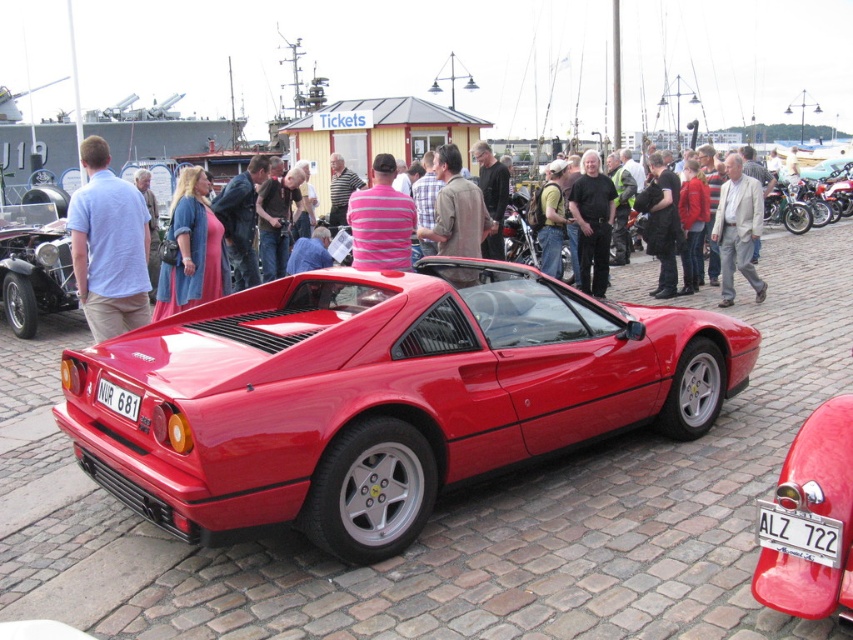
Question: Which point is closer to the camera taking this photo?

Choices:
 (A) (670, 192)
 (B) (115, 179)

Answer: (B)

Question: Which of the following is the farthest from the observer?

Choices:
 (A) (659, 172)
 (B) (198, 260)
 (C) (543, 253)

Answer: (A)

Question: Does denim jacket at center have a larger size compared to matte black shirt at center?

Choices:
 (A) no
 (B) yes

Answer: (A)

Question: Considering the relative positions of matte red ferrari at center and shiny chrome vintage car at left in the image provided, where is matte red ferrari at center located with respect to shiny chrome vintage car at left?

Choices:
 (A) below
 (B) above

Answer: (A)

Question: Which point is closer to the camera?

Choices:
 (A) (730, 264)
 (B) (12, 320)
 (C) (480, 212)

Answer: (C)

Question: Can you confirm if denim jacket at center is wider than gray fabric pants at center?

Choices:
 (A) yes
 (B) no

Answer: (B)